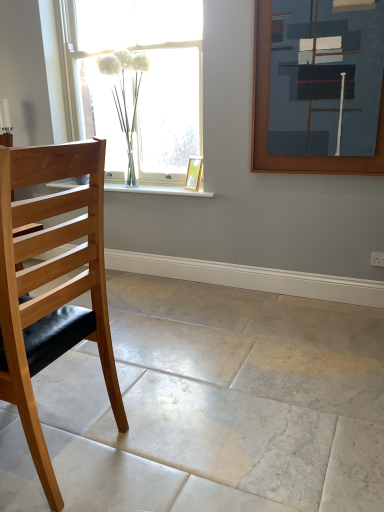
Question: Does brown wooden picture frame at upper right, the 2th picture frame in the left-to-right sequence, have a greater width compared to white marble floor at lower left?

Choices:
 (A) yes
 (B) no

Answer: (B)

Question: Is brown wooden picture frame at upper right, marked as the 2th picture frame in a back-to-front arrangement, facing towards white marble floor at lower left?

Choices:
 (A) no
 (B) yes

Answer: (A)

Question: Is brown wooden picture frame at upper right, marked as the 2th picture frame in a back-to-front arrangement, surrounding white marble floor at lower left?

Choices:
 (A) no
 (B) yes

Answer: (A)

Question: Is brown wooden picture frame at upper right, arranged as the 1th picture frame when viewed from the front, to the left of white marble floor at lower left from the viewer's perspective?

Choices:
 (A) yes
 (B) no

Answer: (B)

Question: Does brown wooden picture frame at upper right, arranged as the 1th picture frame when viewed from the front, have a smaller size compared to white marble floor at lower left?

Choices:
 (A) yes
 (B) no

Answer: (A)

Question: Is brown wooden picture frame at upper right, which is the 1th picture frame from right to left, oriented away from white marble floor at lower left?

Choices:
 (A) yes
 (B) no

Answer: (B)

Question: Could you tell me if light wood/black leather chair at left is facing white marble floor at lower left?

Choices:
 (A) yes
 (B) no

Answer: (B)

Question: Can you confirm if light wood/black leather chair at left is positioned to the left of white marble floor at lower left?

Choices:
 (A) no
 (B) yes

Answer: (B)

Question: Is light wood/black leather chair at left turned away from white marble floor at lower left?

Choices:
 (A) yes
 (B) no

Answer: (B)

Question: Is light wood/black leather chair at left thinner than white marble floor at lower left?

Choices:
 (A) yes
 (B) no

Answer: (A)

Question: Is light wood/black leather chair at left at the right side of white marble floor at lower left?

Choices:
 (A) no
 (B) yes

Answer: (A)

Question: Does light wood/black leather chair at left have a lesser height compared to white marble floor at lower left?

Choices:
 (A) yes
 (B) no

Answer: (B)

Question: Is gold metallic picture frame at window, arranged as the first picture frame when viewed from the back, shorter than light wood/black leather chair at left?

Choices:
 (A) no
 (B) yes

Answer: (B)